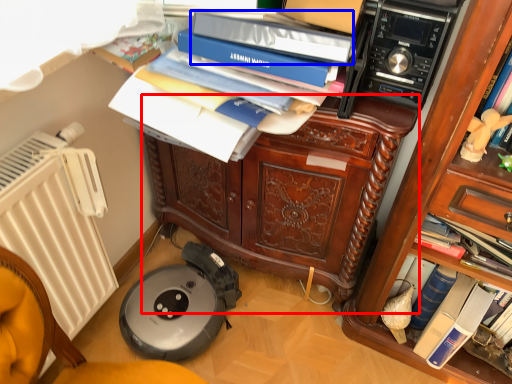
Question: Which of the following is the farthest to the observer, cabinetry (highlighted by a red box) or bin (highlighted by a blue box)?

Choices:
 (A) cabinetry
 (B) bin

Answer: (A)